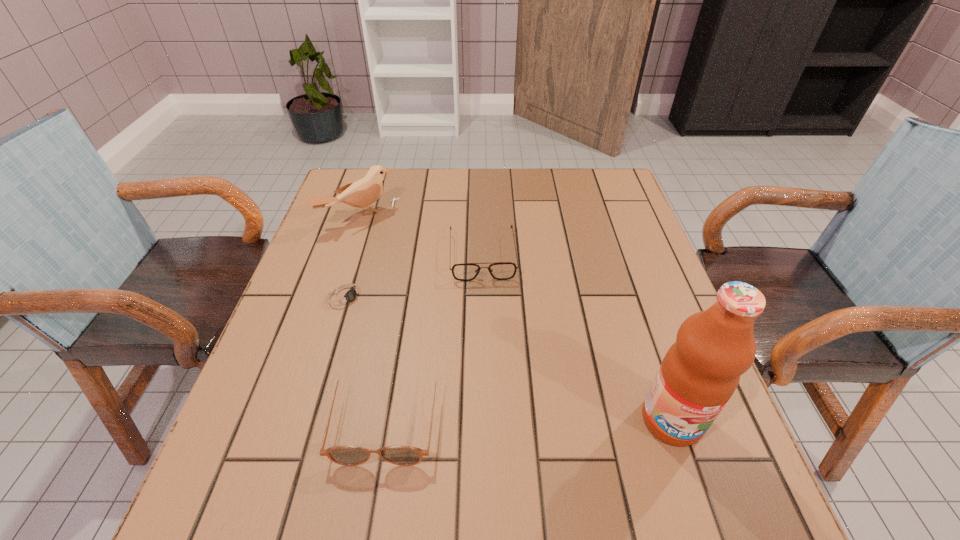
Locate an element on the screen. This screenshot has width=960, height=540. free space between the shortest object and the left sunglasses is located at coordinates (367, 356).

The width and height of the screenshot is (960, 540). I want to click on vacant region between the left sunglasses and the tallest object, so click(x=529, y=418).

Image resolution: width=960 pixels, height=540 pixels. I want to click on free space between the fruit juice and the fourth object from left to right, so click(x=577, y=338).

You are a GUI agent. You are given a task and a screenshot of the screen. Output one action in this format:
    pyautogui.click(x=<x>, y=<y>)
    Task: Click on the free spot between the shortest object and the rightmost object
    The width and height of the screenshot is (960, 540).
    Given the screenshot: What is the action you would take?
    pyautogui.click(x=509, y=357)

The width and height of the screenshot is (960, 540). I want to click on free space between the rightmost object and the watch, so click(509, 357).

Where is `vacant point located between the rightmost object and the nearer sunglasses`? This screenshot has width=960, height=540. vacant point located between the rightmost object and the nearer sunglasses is located at coordinates (529, 418).

Locate an element on the screen. The height and width of the screenshot is (540, 960). free space between the shortest object and the farther sunglasses is located at coordinates (415, 275).

You are a GUI agent. You are given a task and a screenshot of the screen. Output one action in this format:
    pyautogui.click(x=<x>, y=<y>)
    Task: Click on the empty space between the tallest object and the nearer sunglasses
    Image resolution: width=960 pixels, height=540 pixels.
    Given the screenshot: What is the action you would take?
    pyautogui.click(x=529, y=418)

I want to click on empty space that is in between the shortest object and the right sunglasses, so click(415, 275).

The image size is (960, 540). Find the location of `object that can be found as the closest to the bird`. object that can be found as the closest to the bird is located at coordinates (499, 270).